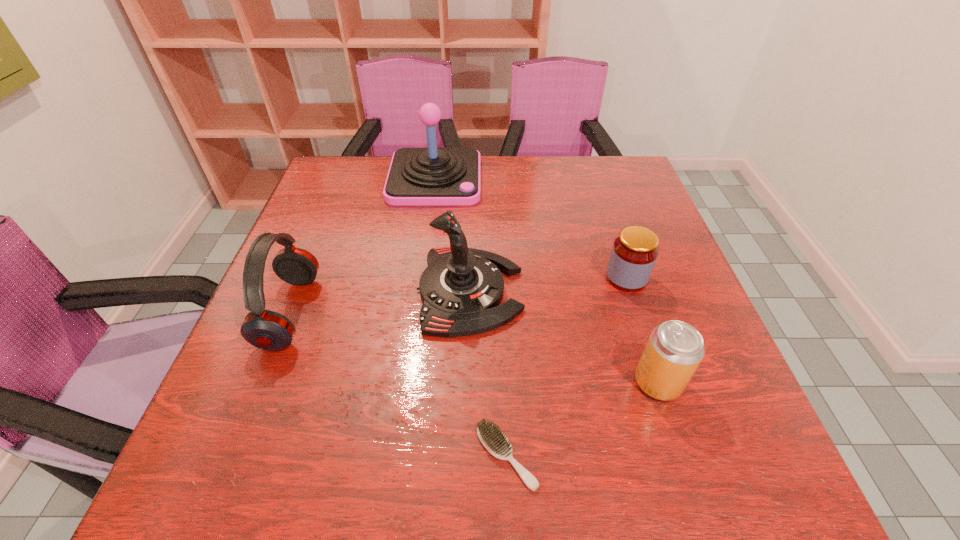
You are a GUI agent. You are given a task and a screenshot of the screen. Output one action in this format:
    pyautogui.click(x=<x>, y=<y>)
    Task: Click on the vacant space that satisfies the following two spatial constraints: 1. on the ear cups of the leftmost object; 2. on the back side of the pop (soda)
    
    Given the screenshot: What is the action you would take?
    pyautogui.click(x=262, y=382)

Where is `free space that satisfies the following two spatial constraints: 1. on the ear cups of the leftmost object; 2. on the left side of the second nearest object`? This screenshot has width=960, height=540. free space that satisfies the following two spatial constraints: 1. on the ear cups of the leftmost object; 2. on the left side of the second nearest object is located at coordinates (262, 382).

Where is `vacant space that satisfies the following two spatial constraints: 1. forward from the base of the jar; 2. on the right side of the farthest object`? Image resolution: width=960 pixels, height=540 pixels. vacant space that satisfies the following two spatial constraints: 1. forward from the base of the jar; 2. on the right side of the farthest object is located at coordinates (421, 278).